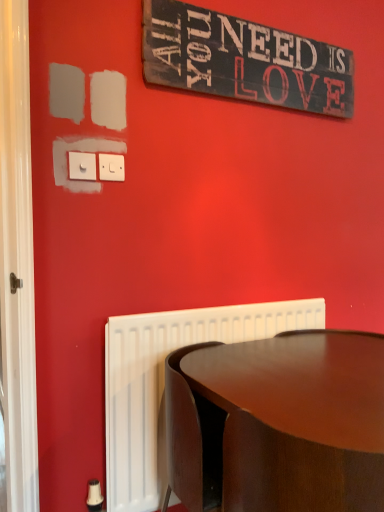
I want to click on glossy wood table at lower right, so click(x=278, y=423).

Locate an element on the screen. The width and height of the screenshot is (384, 512). rustic wood signboard at upper center is located at coordinates (243, 60).

Is white plastic switch at upper left, arranged as the first electric outlet when viewed from the front, at the back of glossy wood table at lower right?

No, glossy wood table at lower right's orientation is not away from white plastic switch at upper left, arranged as the first electric outlet when viewed from the front.

Is glossy wood table at lower right in front of or behind white plastic switch at upper left, arranged as the second electric outlet when viewed from the right, in the image?

glossy wood table at lower right is in front of white plastic switch at upper left, arranged as the second electric outlet when viewed from the right.

Which is correct: glossy wood table at lower right is inside white plastic switch at upper left, arranged as the first electric outlet when viewed from the front, or outside of it?

glossy wood table at lower right lies outside white plastic switch at upper left, arranged as the first electric outlet when viewed from the front.

How many degrees apart are the facing directions of glossy wood table at lower right and white plastic switch at upper left, arranged as the second electric outlet when viewed from the right?

0.00901 degrees.

Is white plastic switch at upper left, the second electric outlet when ordered from front to back, bigger than rustic wood signboard at upper center?

No.

Could you tell me if white plastic switch at upper left, the second electric outlet when ordered from front to back, is facing rustic wood signboard at upper center?

No, white plastic switch at upper left, the second electric outlet when ordered from front to back, is not oriented towards rustic wood signboard at upper center.

Is point (117, 170) more distant than point (250, 49)?

No, (117, 170) is in front of (250, 49).

In the image, there is a white plastic switch at upper left, placed as the first electric outlet when sorted from left to right. Identify the location of electric outlet above it (from the image's perspective). The width and height of the screenshot is (384, 512). (111, 167).

Could you tell me if white plastic switch at upper left, placed as the second electric outlet when sorted from left to right, is turned towards white plastic switch at upper left, placed as the first electric outlet when sorted from left to right?

No, white plastic switch at upper left, placed as the second electric outlet when sorted from left to right, is not aimed at white plastic switch at upper left, placed as the first electric outlet when sorted from left to right.

Between white plastic switch at upper left, the first electric outlet when ordered from right to left, and white plastic switch at upper left, arranged as the second electric outlet when viewed from the right, which one appears on the right side from the viewer's perspective?

From the viewer's perspective, white plastic switch at upper left, the first electric outlet when ordered from right to left, appears more on the right side.

Is white plastic switch at upper left, arranged as the first electric outlet when viewed from the front, located within white plastic switch at upper left, the first electric outlet when ordered from right to left?

No.

I want to click on bulletin board on the right of white plastic switch at upper left, arranged as the first electric outlet when viewed from the front, so click(243, 60).

From a real-world perspective, does rustic wood signboard at upper center sit lower than white plastic switch at upper left, arranged as the second electric outlet when viewed from the right?

Actually, rustic wood signboard at upper center is physically above white plastic switch at upper left, arranged as the second electric outlet when viewed from the right, in the real world.

Which is in front, rustic wood signboard at upper center or white plastic switch at upper left, acting as the 2th electric outlet starting from the back?

white plastic switch at upper left, acting as the 2th electric outlet starting from the back, is in front.

Can you confirm if rustic wood signboard at upper center is positioned to the left of white plastic switch at upper left, arranged as the first electric outlet when viewed from the front?

In fact, rustic wood signboard at upper center is to the right of white plastic switch at upper left, arranged as the first electric outlet when viewed from the front.

From the image's perspective, between white plastic switch at upper left, placed as the first electric outlet when sorted from left to right, and glossy wood table at lower right, who is located below?

glossy wood table at lower right appears lower in the image.

Is white plastic switch at upper left, arranged as the second electric outlet when viewed from the right, located outside glossy wood table at lower right?

Yes.

At what (x,y) coordinates should I click in order to perform the action: click on the 1st electric outlet positioned above the glossy wood table at lower right (from the image's perspective). Please return your answer as a coordinate pair (x, y). Looking at the image, I should click on (82, 166).

Which is behind, point (77, 173) or point (225, 365)?

The point (77, 173) is behind.

From the image's perspective, is white glossy door at left below white plastic switch at upper left, which is counted as the 1th electric outlet, starting from the back?

Indeed, from the image's perspective, white glossy door at left is shown beneath white plastic switch at upper left, which is counted as the 1th electric outlet, starting from the back.

Which object is positioned more to the left, white glossy door at left or white plastic switch at upper left, the first electric outlet when ordered from right to left?

white glossy door at left is more to the left.

Is white glossy door at left placed right next to white plastic switch at upper left, the second electric outlet when ordered from front to back?

No, white glossy door at left is not in contact with white plastic switch at upper left, the second electric outlet when ordered from front to back.

Looking at this image, considering the sizes of objects white glossy door at left and white plastic switch at upper left, the second electric outlet when ordered from front to back, in the image provided, who is shorter, white glossy door at left or white plastic switch at upper left, the second electric outlet when ordered from front to back,?

white plastic switch at upper left, the second electric outlet when ordered from front to back.

From a real-world perspective, is glossy wood table at lower right physically located above or below white plastic switch at upper left, the second electric outlet when ordered from front to back?

glossy wood table at lower right is below white plastic switch at upper left, the second electric outlet when ordered from front to back.

Considering the sizes of objects glossy wood table at lower right and white plastic switch at upper left, the second electric outlet when ordered from front to back, in the image provided, who is wider, glossy wood table at lower right or white plastic switch at upper left, the second electric outlet when ordered from front to back,?

glossy wood table at lower right is wider.

Locate an element on the screen. table beneath the white plastic switch at upper left, the first electric outlet when ordered from right to left (from a real-world perspective) is located at coordinates (278, 423).

Locate an element on the screen. The image size is (384, 512). the 1st electric outlet above the glossy wood table at lower right (from the image's perspective) is located at coordinates (82, 166).

There is a rustic wood signboard at upper center. What are the coordinates of `the 1st electric outlet below it (from a real-world perspective)` in the screenshot? It's located at (111, 167).

Based on their spatial positions, is glossy wood table at lower right or white plastic switch at upper left, arranged as the first electric outlet when viewed from the front, further from white glossy door at left?

glossy wood table at lower right is further to white glossy door at left.

Which object lies nearer to the anchor point glossy wood table at lower right, rustic wood signboard at upper center or white glossy door at left?

white glossy door at left lies closer to glossy wood table at lower right than the other object.

Considering their positions, is glossy wood table at lower right positioned closer to white glossy door at left than rustic wood signboard at upper center?

glossy wood table at lower right is closer to white glossy door at left.

Looking at the image, which one is located further to glossy wood table at lower right, white glossy door at left or white plastic switch at upper left, arranged as the second electric outlet when viewed from the right?

The object further to glossy wood table at lower right is white plastic switch at upper left, arranged as the second electric outlet when viewed from the right.

Which object lies nearer to the anchor point white plastic switch at upper left, arranged as the second electric outlet when viewed from the right, glossy wood table at lower right or rustic wood signboard at upper center?

rustic wood signboard at upper center is closer to white plastic switch at upper left, arranged as the second electric outlet when viewed from the right.

Estimate the real-world distances between objects in this image. Which object is closer to rustic wood signboard at upper center, white glossy door at left or glossy wood table at lower right?

white glossy door at left is closer to rustic wood signboard at upper center.

Considering their positions, is white plastic switch at upper left, placed as the second electric outlet when sorted from left to right, positioned closer to rustic wood signboard at upper center than glossy wood table at lower right?

white plastic switch at upper left, placed as the second electric outlet when sorted from left to right.

From the image, which object appears to be nearer to rustic wood signboard at upper center, white glossy door at left or white plastic switch at upper left, arranged as the second electric outlet when viewed from the right?

white plastic switch at upper left, arranged as the second electric outlet when viewed from the right, lies closer to rustic wood signboard at upper center than the other object.

Where is `electric outlet between white plastic switch at upper left, the second electric outlet when ordered from front to back, and glossy wood table at lower right, in the vertical direction`? This screenshot has width=384, height=512. electric outlet between white plastic switch at upper left, the second electric outlet when ordered from front to back, and glossy wood table at lower right, in the vertical direction is located at coordinates pyautogui.click(x=82, y=166).

Locate an element on the screen. screen door between rustic wood signboard at upper center and glossy wood table at lower right vertically is located at coordinates (17, 262).

This screenshot has width=384, height=512. Identify the location of electric outlet that lies between white plastic switch at upper left, the second electric outlet when ordered from front to back, and white glossy door at left from top to bottom. (82, 166).

Find the location of a particular element. The image size is (384, 512). screen door between white plastic switch at upper left, which is counted as the 1th electric outlet, starting from the back, and glossy wood table at lower right, in the vertical direction is located at coordinates (17, 262).